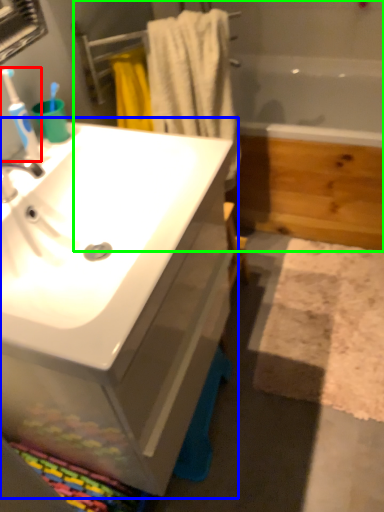
Question: Estimate the real-world distances between objects in this image. Which object is closer to toothbrush (highlighted by a red box), bathroom cabinet (highlighted by a blue box) or bath (highlighted by a green box)?

Choices:
 (A) bathroom cabinet
 (B) bath

Answer: (A)